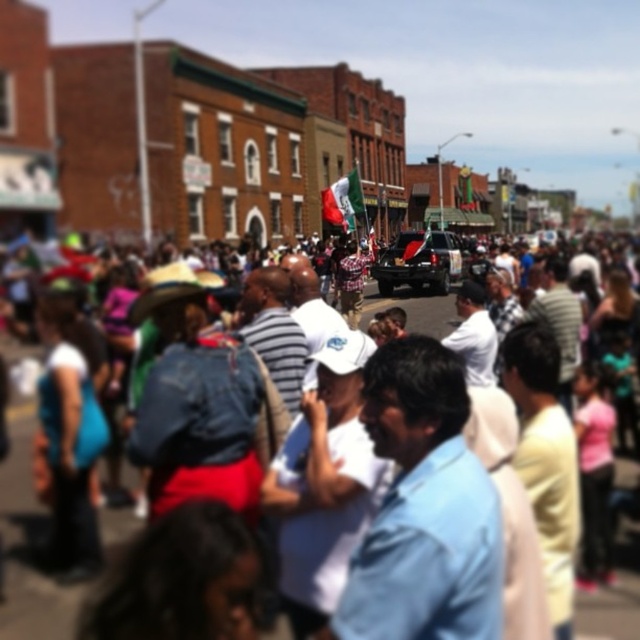
Question: Is red flag at center below shiny black suv at center?

Choices:
 (A) yes
 (B) no

Answer: (A)

Question: Is the position of red flag at center less distant than that of shiny black suv at center?

Choices:
 (A) no
 (B) yes

Answer: (B)

Question: Which object appears closest to the camera in this image?

Choices:
 (A) red flag at center
 (B) shiny black suv at center

Answer: (A)

Question: Is red flag at center below shiny black suv at center?

Choices:
 (A) no
 (B) yes

Answer: (B)

Question: Which point is farther to the camera?

Choices:
 (A) red flag at center
 (B) shiny black suv at center

Answer: (B)